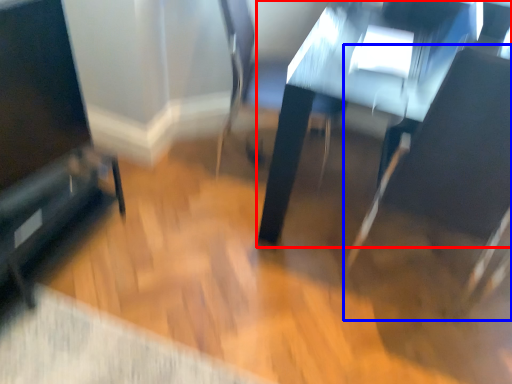
Question: Which of the following is the closest to the observer, table (highlighted by a red box) or swivel chair (highlighted by a blue box)?

Choices:
 (A) table
 (B) swivel chair

Answer: (B)